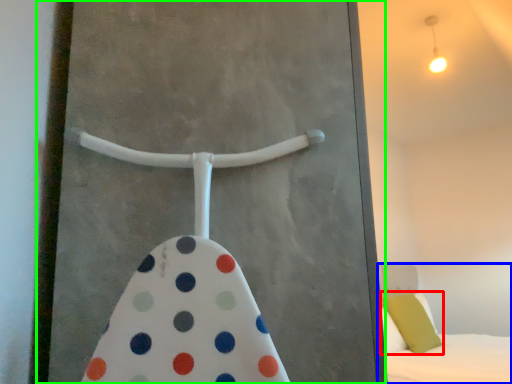
Question: Which is nearer to the pillow (highlighted by a red box)? bed (highlighted by a blue box) or screen door (highlighted by a green box).

Choices:
 (A) bed
 (B) screen door

Answer: (A)